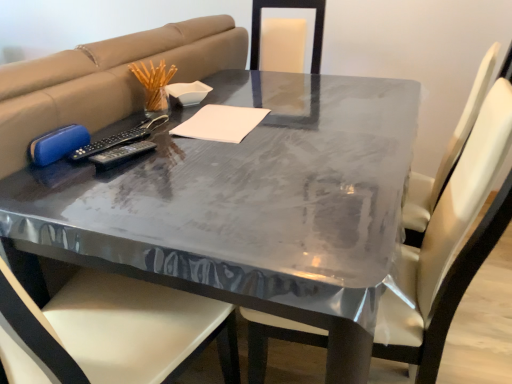
Question: Looking at the image, does glossy plastic table at center seem bigger or smaller compared to black plastic remote at center?

Choices:
 (A) big
 (B) small

Answer: (A)

Question: In terms of height, does glossy plastic table at center look taller or shorter compared to black plastic remote at center?

Choices:
 (A) short
 (B) tall

Answer: (B)

Question: Which is nearer to the glossy plastic table at center?

Choices:
 (A) white paper at center
 (B) white leather chair at center
 (C) black plastic remote at center

Answer: (B)

Question: Which object is positioned farthest from the white leather chair at center?

Choices:
 (A) glossy plastic table at center
 (B) black plastic remote at center
 (C) white paper at center

Answer: (B)